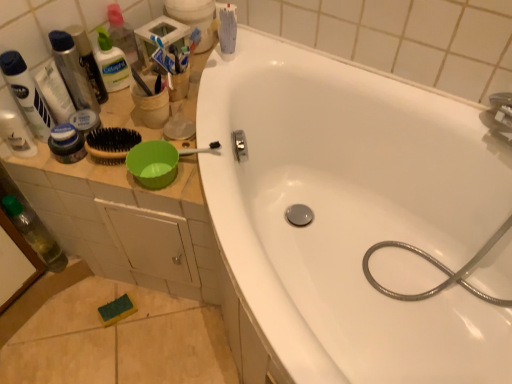
Find the location of a particular element. This screenshot has width=512, height=384. vacant area that is situated to the right of brown bristle brush at upper left is located at coordinates (206, 99).